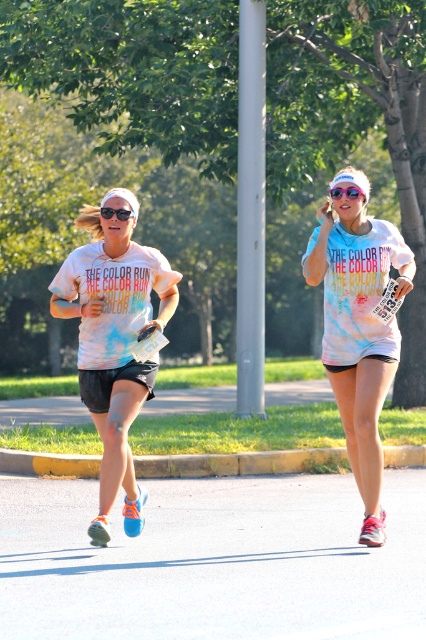
Is tie-dye cotton shirt at center wider than black plastic sunglasses at upper center?

Indeed, tie-dye cotton shirt at center has a greater width compared to black plastic sunglasses at upper center.

How distant is tie-dye cotton shirt at center from black plastic sunglasses at upper center?

tie-dye cotton shirt at center and black plastic sunglasses at upper center are 21.50 inches apart.

Is point (376, 278) positioned after point (129, 209)?

Yes, point (376, 278) is behind point (129, 209).

Locate an element on the screen. This screenshot has height=640, width=426. tie-dye cotton shirt at center is located at coordinates (359, 332).

Can you confirm if white tie-dye shirt at left is positioned above tie-dye fabric shirt at center?

Indeed, white tie-dye shirt at left is positioned over tie-dye fabric shirt at center.

Consider the image. Who is taller, white tie-dye shirt at left or tie-dye fabric shirt at center?

white tie-dye shirt at left

Which is behind, point (120, 317) or point (368, 364)?

The point (120, 317) is behind.

Find the location of a particular element. white tie-dye shirt at left is located at coordinates (114, 340).

Is point (71, 288) in front of point (103, 216)?

No, it is behind (103, 216).

Is white tie-dye shirt at left shorter than black plastic sunglasses at upper center?

No, white tie-dye shirt at left is not shorter than black plastic sunglasses at upper center.

Find the location of `white tie-dye shirt at left`. white tie-dye shirt at left is located at coordinates (114, 340).

Locate an element on the screen. This screenshot has width=426, height=640. white tie-dye shirt at left is located at coordinates [x=114, y=340].